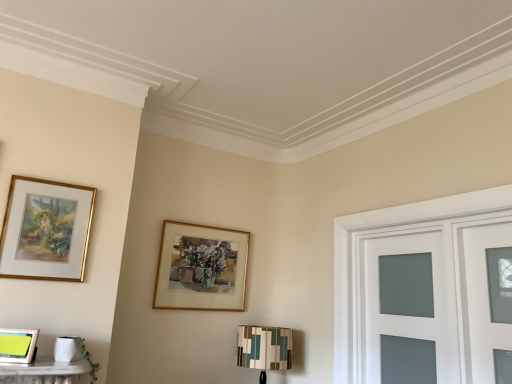
In order to click on matte glass door at right in this screenshot , I will do `click(409, 308)`.

Looking at this image, in order to face gold-framed picture at upper center, the 1th picture frame when ordered from back to front, should I rotate leftwards or rightwards?

To align with it, rotate left about 6.677°.

You are a GUI agent. You are given a task and a screenshot of the screen. Output one action in this format:
    pyautogui.click(x=<x>, y=<y>)
    Task: Click on the multicolored fabric lampshade at lower right
    The image size is (512, 384).
    Given the screenshot: What is the action you would take?
    pyautogui.click(x=264, y=348)

At what (x,y) coordinates should I click in order to perform the action: click on metallic silver picture frame at lower left, positioned as the third picture frame in back-to-front order. Please return your answer as a coordinate pair (x, y). The image size is (512, 384). Looking at the image, I should click on (17, 345).

At what (x,y) coordinates should I click in order to perform the action: click on matte glass door at right. Please return your answer as a coordinate pair (x, y). Looking at the image, I should click on (409, 308).

How far apart are gold-framed picture at upper center, which is counted as the 3th picture frame, starting from the left, and multicolored fabric lampshade at lower right?

gold-framed picture at upper center, which is counted as the 3th picture frame, starting from the left, and multicolored fabric lampshade at lower right are 45.50 centimeters apart from each other.

From a real-world perspective, who is located lower, gold-framed picture at upper center, placed as the third picture frame when sorted from front to back, or multicolored fabric lampshade at lower right?

multicolored fabric lampshade at lower right, from a real-world perspective.

Is gold-framed picture at upper center, the 1th picture frame when ordered from back to front, wider than multicolored fabric lampshade at lower right?

No.

Is gold-framed picture at upper center, the 1th picture frame positioned from the right, facing away from multicolored fabric lampshade at lower right?

That's not correct — gold-framed picture at upper center, the 1th picture frame positioned from the right, is not looking away from multicolored fabric lampshade at lower right.

Which of these two, multicolored fabric lampshade at lower right or matte glass door at right, is wider?

With larger width is multicolored fabric lampshade at lower right.

Is point (262, 378) closer to camera compared to point (362, 379)?

No, it is behind (362, 379).

Between multicolored fabric lampshade at lower right and matte glass door at right, which one is positioned behind?

Positioned behind is multicolored fabric lampshade at lower right.

Is multicolored fabric lampshade at lower right outside of matte glass door at right?

Yes, multicolored fabric lampshade at lower right is not within matte glass door at right.

Looking at their sizes, would you say gold-framed painting at upper left, which ranks as the second picture frame in left-to-right order, is wider or thinner than multicolored fabric lampshade at lower right?

In the image, gold-framed painting at upper left, which ranks as the second picture frame in left-to-right order, appears to be more narrow than multicolored fabric lampshade at lower right.

From a real-world perspective, which object stands above the other?

gold-framed painting at upper left, the second picture frame viewed from the back.

Is gold-framed painting at upper left, acting as the second picture frame starting from the front, facing towards multicolored fabric lampshade at lower right?

No, gold-framed painting at upper left, acting as the second picture frame starting from the front, is not facing towards multicolored fabric lampshade at lower right.

Is point (62, 207) closer or farther from the camera than point (258, 329)?

Clearly, point (62, 207) is closer to the camera than point (258, 329).

In the image, is metallic silver picture frame at lower left, which is counted as the first picture frame, starting from the left, on the left side or the right side of gold-framed picture at upper center, the 1th picture frame positioned from the right?

In the image, metallic silver picture frame at lower left, which is counted as the first picture frame, starting from the left, appears on the left side of gold-framed picture at upper center, the 1th picture frame positioned from the right.

Is metallic silver picture frame at lower left, positioned as the third picture frame in back-to-front order, bigger than gold-framed picture at upper center, the 1th picture frame positioned from the right?

Incorrect, metallic silver picture frame at lower left, positioned as the third picture frame in back-to-front order, is not larger than gold-framed picture at upper center, the 1th picture frame positioned from the right.

Considering the sizes of metallic silver picture frame at lower left, which appears as the 1th picture frame when viewed from the front, and gold-framed picture at upper center, the 1th picture frame positioned from the right, in the image, is metallic silver picture frame at lower left, which appears as the 1th picture frame when viewed from the front, wider or thinner than gold-framed picture at upper center, the 1th picture frame positioned from the right,?

metallic silver picture frame at lower left, which appears as the 1th picture frame when viewed from the front, is wider than gold-framed picture at upper center, the 1th picture frame positioned from the right.

From a real-world perspective, between metallic silver picture frame at lower left, which appears as the 1th picture frame when viewed from the front, and gold-framed picture at upper center, the 1th picture frame when ordered from back to front, who is vertically higher?

In real-world perspective, gold-framed picture at upper center, the 1th picture frame when ordered from back to front, is above.

What's the angular difference between matte glass door at right and multicolored fabric lampshade at lower right's facing directions?

The facing directions of matte glass door at right and multicolored fabric lampshade at lower right are 89.1 degrees apart.

From a real-world perspective, is matte glass door at right physically above multicolored fabric lampshade at lower right?

Yes, from a real-world perspective, matte glass door at right is over multicolored fabric lampshade at lower right

Between matte glass door at right and multicolored fabric lampshade at lower right, which one is positioned behind?

Positioned behind is multicolored fabric lampshade at lower right.

Between matte glass door at right and multicolored fabric lampshade at lower right, which one has larger size?

With larger size is multicolored fabric lampshade at lower right.

Is multicolored fabric lampshade at lower right positioned with its back to gold-framed painting at upper left, acting as the second picture frame starting from the front?

No, multicolored fabric lampshade at lower right's orientation is not away from gold-framed painting at upper left, acting as the second picture frame starting from the front.

From the image's perspective, between multicolored fabric lampshade at lower right and gold-framed painting at upper left, the second picture frame positioned from the right, who is located below?

multicolored fabric lampshade at lower right, from the image's perspective.

Considering the sizes of multicolored fabric lampshade at lower right and gold-framed painting at upper left, the second picture frame positioned from the right, in the image, is multicolored fabric lampshade at lower right bigger or smaller than gold-framed painting at upper left, the second picture frame positioned from the right,?

In the image, multicolored fabric lampshade at lower right appears to be larger than gold-framed painting at upper left, the second picture frame positioned from the right.

Would you say multicolored fabric lampshade at lower right is inside or outside gold-framed painting at upper left, the second picture frame viewed from the back?

multicolored fabric lampshade at lower right is outside gold-framed painting at upper left, the second picture frame viewed from the back.

Is multicolored fabric lampshade at lower right turned away from gold-framed picture at upper center, which is counted as the 3th picture frame, starting from the left?

No, multicolored fabric lampshade at lower right is not facing away from gold-framed picture at upper center, which is counted as the 3th picture frame, starting from the left.

From a real-world perspective, who is located lower, multicolored fabric lampshade at lower right or gold-framed picture at upper center, placed as the third picture frame when sorted from front to back?

multicolored fabric lampshade at lower right is physically lower.

Is point (257, 349) farther from camera compared to point (221, 245)?

No.

Is multicolored fabric lampshade at lower right touching gold-framed picture at upper center, which is counted as the 3th picture frame, starting from the left?

There is a gap between multicolored fabric lampshade at lower right and gold-framed picture at upper center, which is counted as the 3th picture frame, starting from the left.

You are a GUI agent. You are given a task and a screenshot of the screen. Output one action in this format:
    pyautogui.click(x=<x>, y=<y>)
    Task: Click on the table lamp below the gold-framed picture at upper center, placed as the third picture frame when sorted from front to back (from the image's perspective)
    
    Given the screenshot: What is the action you would take?
    pyautogui.click(x=264, y=348)

The width and height of the screenshot is (512, 384). I want to click on glass door above the multicolored fabric lampshade at lower right (from a real-world perspective), so click(x=409, y=308).

Which object lies nearer to the anchor point gold-framed painting at upper left, acting as the second picture frame starting from the front, matte glass door at right or metallic silver picture frame at lower left, which is counted as the first picture frame, starting from the left?

metallic silver picture frame at lower left, which is counted as the first picture frame, starting from the left, is positioned closer to the anchor gold-framed painting at upper left, acting as the second picture frame starting from the front.

Estimate the real-world distances between objects in this image. Which object is closer to gold-framed picture at upper center, placed as the third picture frame when sorted from front to back, matte glass door at right or metallic silver picture frame at lower left, which is counted as the first picture frame, starting from the left?

matte glass door at right.

When comparing their distances from matte glass door at right, does gold-framed picture at upper center, the 1th picture frame positioned from the right, or metallic silver picture frame at lower left, which appears as the 1th picture frame when viewed from the front, seem further?

metallic silver picture frame at lower left, which appears as the 1th picture frame when viewed from the front, is positioned further to the anchor matte glass door at right.

Based on their spatial positions, is metallic silver picture frame at lower left, which is counted as the first picture frame, starting from the left, or multicolored fabric lampshade at lower right closer to gold-framed picture at upper center, the 1th picture frame positioned from the right?

Based on the image, multicolored fabric lampshade at lower right appears to be nearer to gold-framed picture at upper center, the 1th picture frame positioned from the right.

When comparing their distances from gold-framed painting at upper left, acting as the second picture frame starting from the front, does gold-framed picture at upper center, which is counted as the 3th picture frame, starting from the left, or metallic silver picture frame at lower left, the third picture frame positioned from the right, seem further?

The object further to gold-framed painting at upper left, acting as the second picture frame starting from the front, is gold-framed picture at upper center, which is counted as the 3th picture frame, starting from the left.

Looking at this image, based on their spatial positions, is metallic silver picture frame at lower left, which appears as the 1th picture frame when viewed from the front, or gold-framed picture at upper center, placed as the third picture frame when sorted from front to back, further from gold-framed painting at upper left, the second picture frame viewed from the back?

The object further to gold-framed painting at upper left, the second picture frame viewed from the back, is gold-framed picture at upper center, placed as the third picture frame when sorted from front to back.

Which object lies nearer to the anchor point matte glass door at right, multicolored fabric lampshade at lower right or gold-framed painting at upper left, acting as the second picture frame starting from the front?

The object closer to matte glass door at right is multicolored fabric lampshade at lower right.

Estimate the real-world distances between objects in this image. Which object is further from multicolored fabric lampshade at lower right, gold-framed painting at upper left, the second picture frame viewed from the back, or matte glass door at right?

gold-framed painting at upper left, the second picture frame viewed from the back, is further to multicolored fabric lampshade at lower right.

The image size is (512, 384). I want to click on picture frame located between metallic silver picture frame at lower left, positioned as the third picture frame in back-to-front order, and gold-framed picture at upper center, placed as the third picture frame when sorted from front to back, in the depth direction, so click(46, 230).

Where is `picture frame between gold-framed painting at upper left, which ranks as the second picture frame in left-to-right order, and multicolored fabric lampshade at lower right`? picture frame between gold-framed painting at upper left, which ranks as the second picture frame in left-to-right order, and multicolored fabric lampshade at lower right is located at coordinates (201, 268).

Find the location of a particular element. table lamp between gold-framed picture at upper center, the 1th picture frame when ordered from back to front, and matte glass door at right from left to right is located at coordinates (264, 348).

This screenshot has width=512, height=384. Find the location of `picture frame located between gold-framed painting at upper left, the second picture frame positioned from the right, and matte glass door at right in the left-right direction`. picture frame located between gold-framed painting at upper left, the second picture frame positioned from the right, and matte glass door at right in the left-right direction is located at coordinates (201, 268).